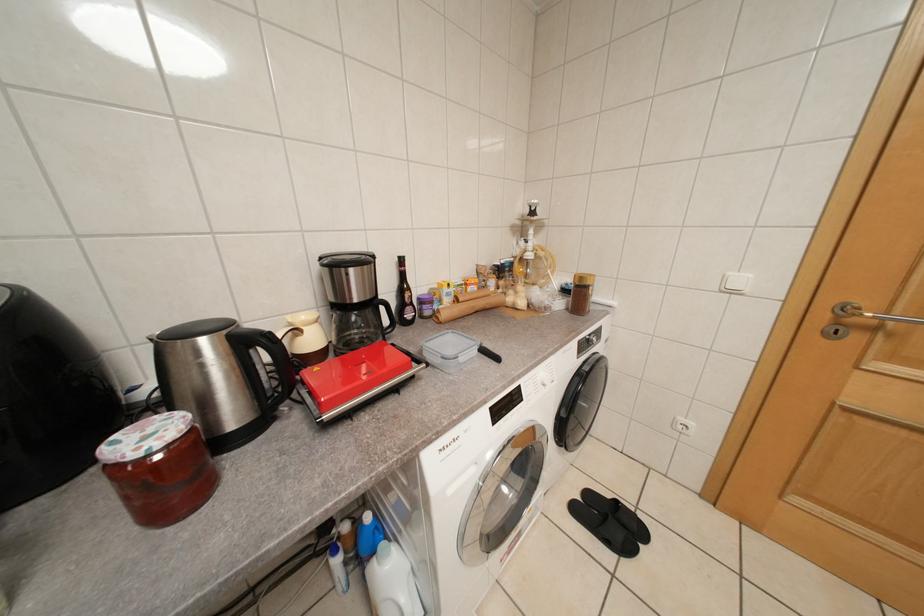
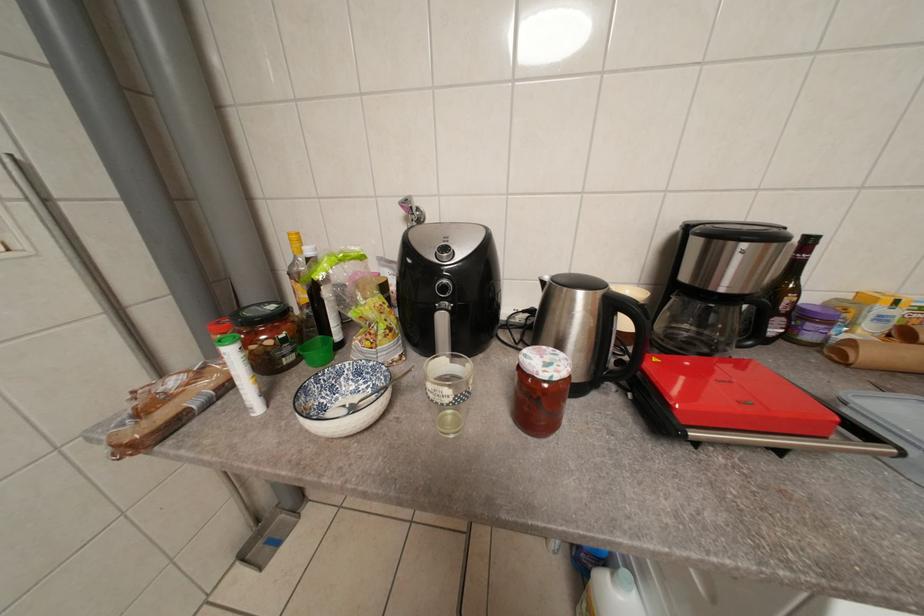
Question: The images are taken continuously from a first-person perspective. In which direction is your viewpoint rotating?

Choices:
 (A) Left
 (B) Right
 (C) Up
 (D) Down

Answer: (A)